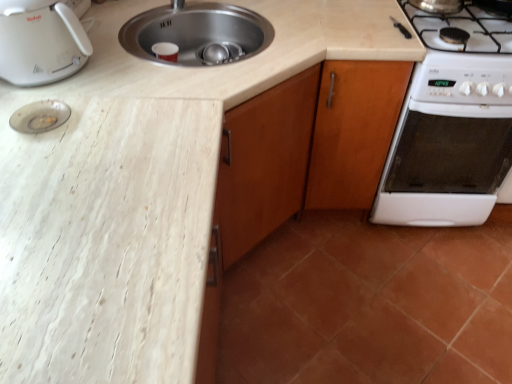
Find the location of a particular element. The image size is (512, 384). unoccupied space behind transparent glass plate at upper left is located at coordinates (71, 84).